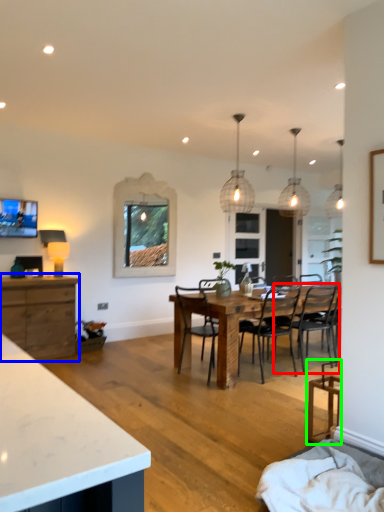
Question: Estimate the real-world distances between objects in this image. Which object is closer to chair (highlighted by a red box), cabinetry (highlighted by a blue box) or chair (highlighted by a green box)?

Choices:
 (A) cabinetry
 (B) chair

Answer: (B)